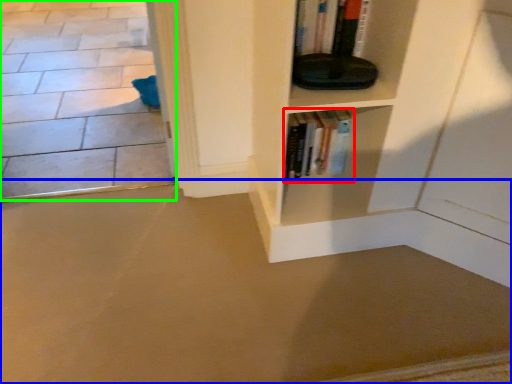
Question: Based on their relative distances, which object is farther from book (highlighted by a red box)? Choose from concrete (highlighted by a blue box) and concrete (highlighted by a green box).

Choices:
 (A) concrete
 (B) concrete

Answer: (B)